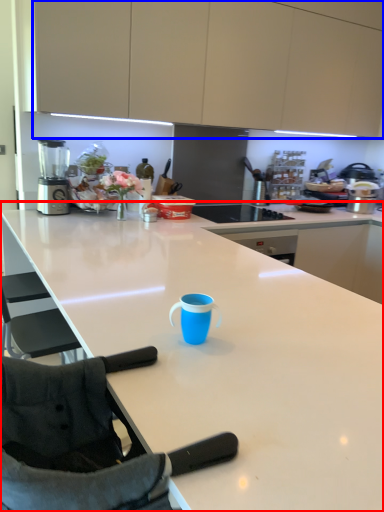
Question: Which object appears farthest to the camera in this image, countertop (highlighted by a red box) or cabinetry (highlighted by a blue box)?

Choices:
 (A) countertop
 (B) cabinetry

Answer: (B)